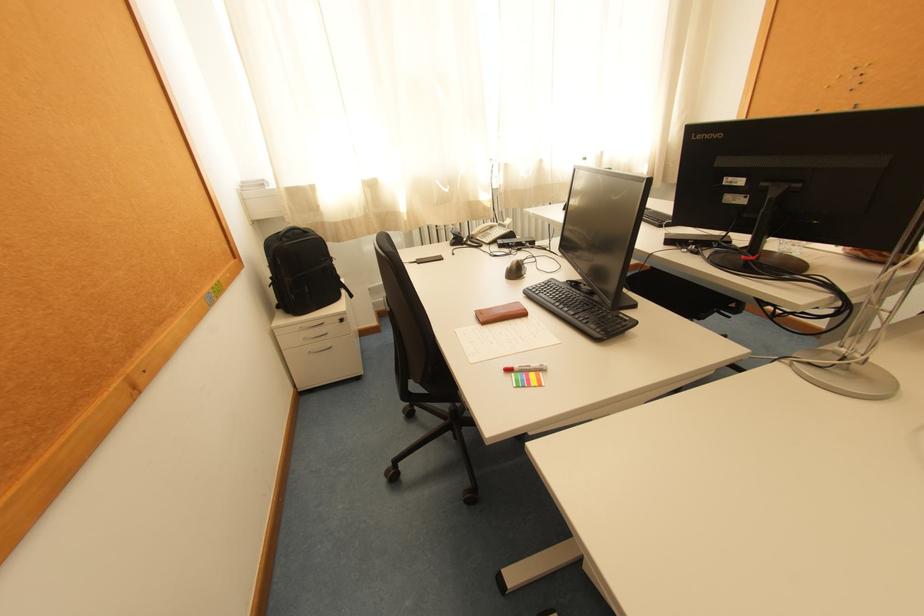
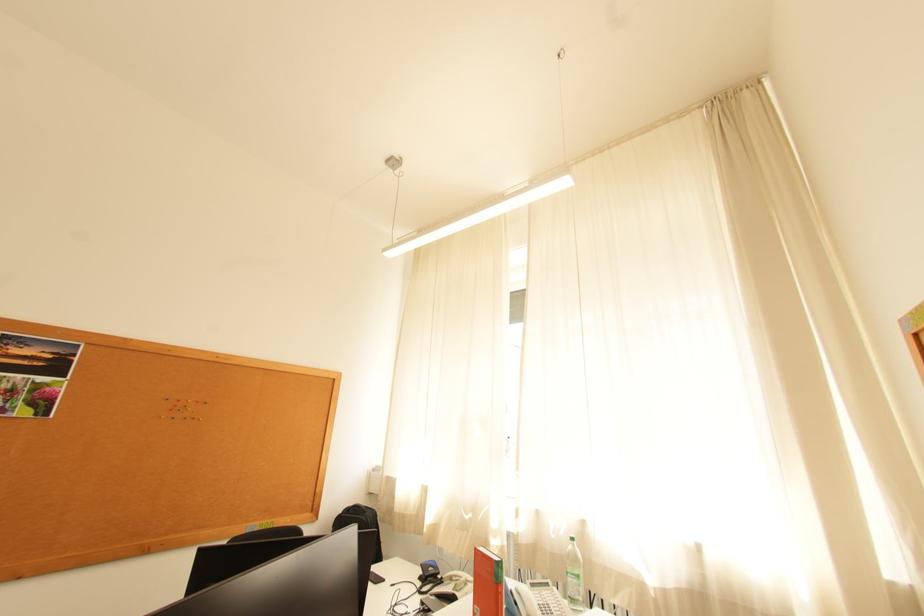
The point at (x=539, y=176) is marked in the first image. Where is the corresponding point in the second image?

(569, 536)